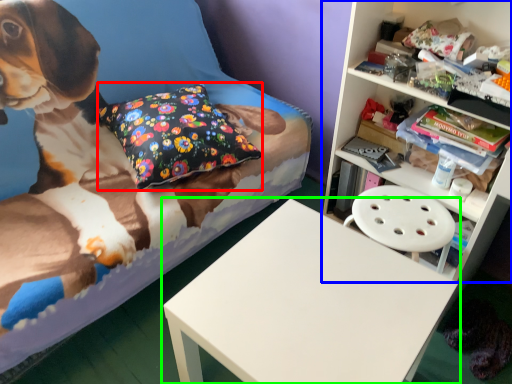
Question: Estimate the real-world distances between objects in this image. Which object is farther from pillow (highlighted by a red box), shelf (highlighted by a blue box) or table (highlighted by a green box)?

Choices:
 (A) shelf
 (B) table

Answer: (A)